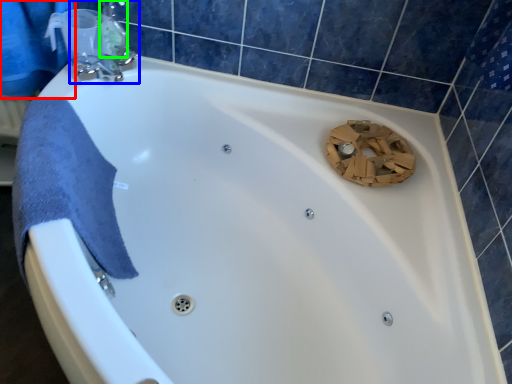
Question: Which object is the closest to the shower curtain (highlighted by a red box)? Choose among these: tap (highlighted by a blue box) or toiletry (highlighted by a green box).

Choices:
 (A) tap
 (B) toiletry

Answer: (A)